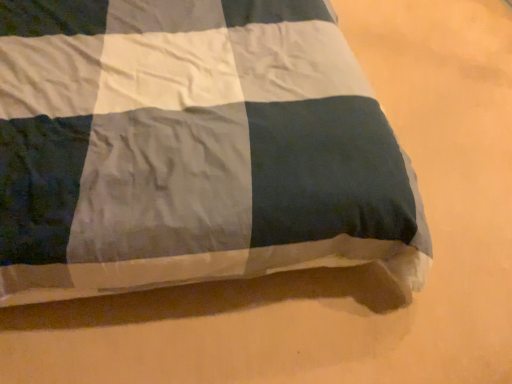
The image size is (512, 384). I want to click on white cotton bed at center, so click(x=192, y=149).

What do you see at coordinates (192, 149) in the screenshot? This screenshot has width=512, height=384. I see `white cotton bed at center` at bounding box center [192, 149].

What is the approximate height of white cotton bed at center?

The height of white cotton bed at center is 2.03 inches.

Measure the distance between white cotton bed at center and camera.

The distance of white cotton bed at center from camera is 38.01 inches.

This screenshot has height=384, width=512. I want to click on white cotton bed at center, so click(192, 149).